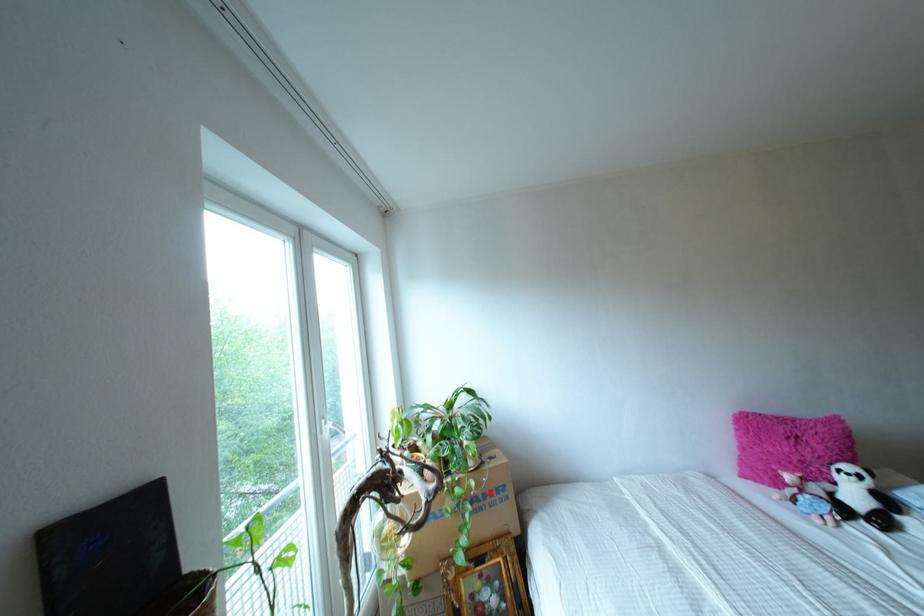
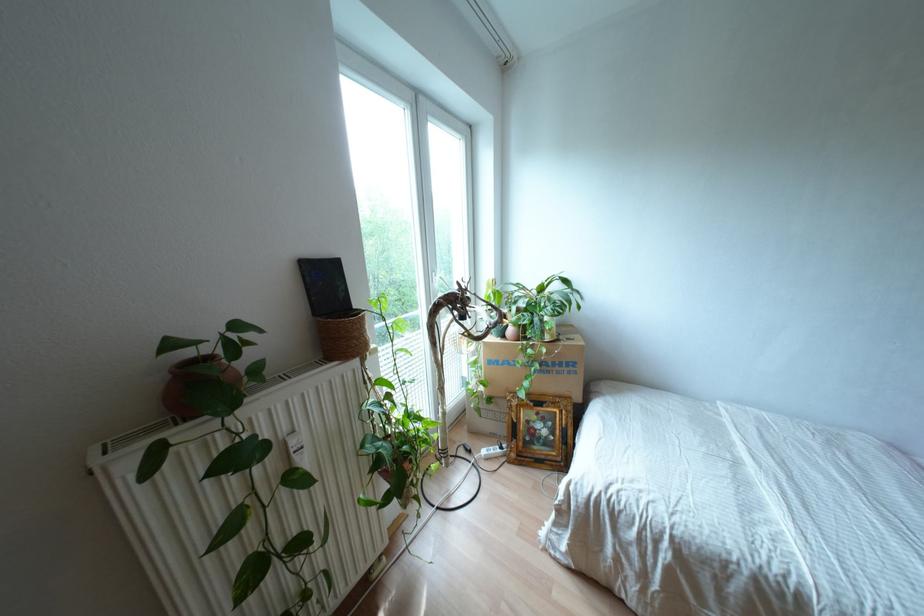
The point at the highlighted location is marked in the first image. Where is the corresponding point in the second image?

(560, 363)